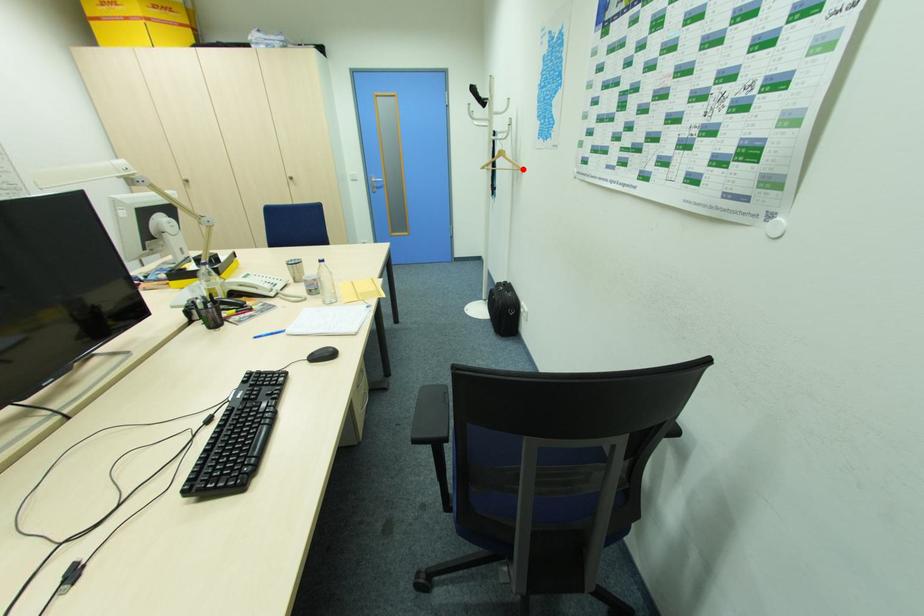
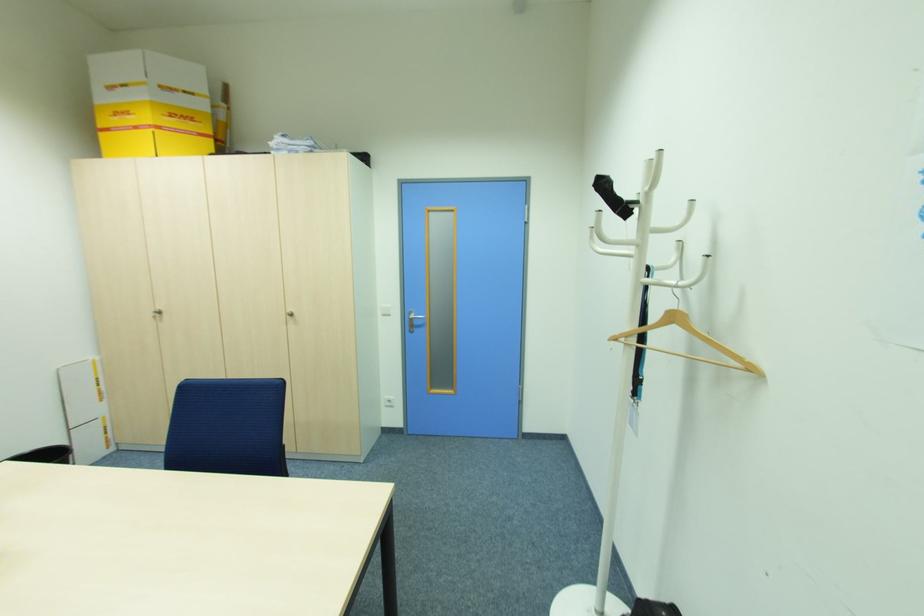
Locate, in the second image, the point that corresponds to the highlighted location in the first image.

(756, 370)